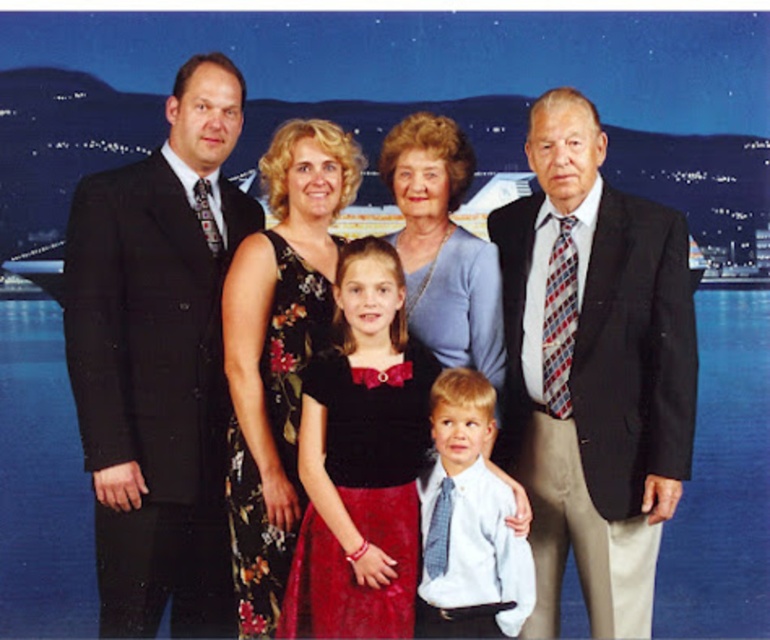
You are a photographer trying to decide where to place a new family member wearing a velvet black dress at center and a floral dress at center. Given their sizes, which dress should be placed closer to the camera to ensure both are visible in the photo?

The velvet black dress at center has a smaller size compared to floral dress at center, so placing the velvet black dress at center closer to the camera will help balance their visibility in the photo.

From the picture: You are standing in front of the family photo. The photographer wants to add a decorative frame around the point at coordinates point (363, 570). If the frame needs to be placed exactly 450 feet away from you, will the frame fit perfectly at that point?

The point (363, 570) is 453.36 feet from the viewer, so the frame placed at exactly 450 feet would be slightly closer than the required distance, making it not fit perfectly at that point.